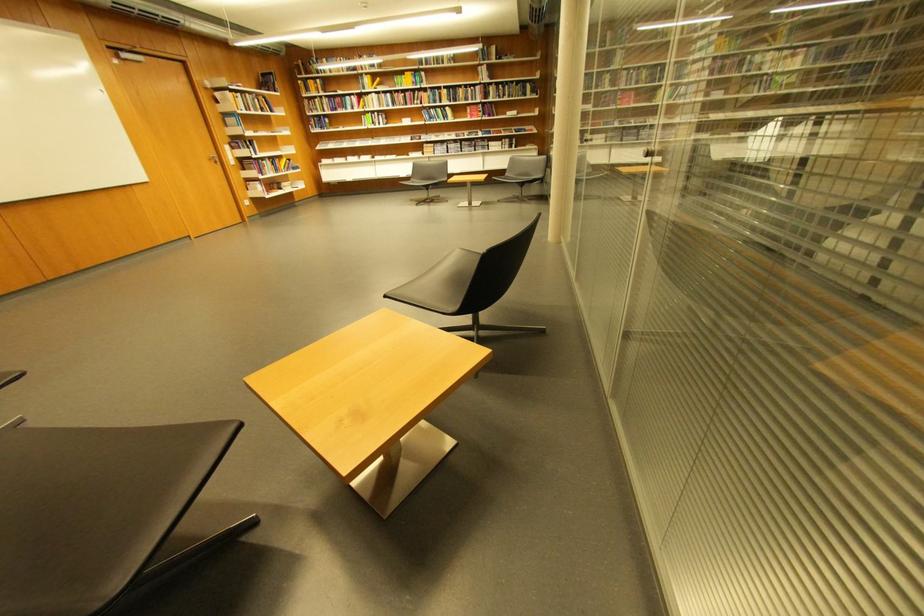
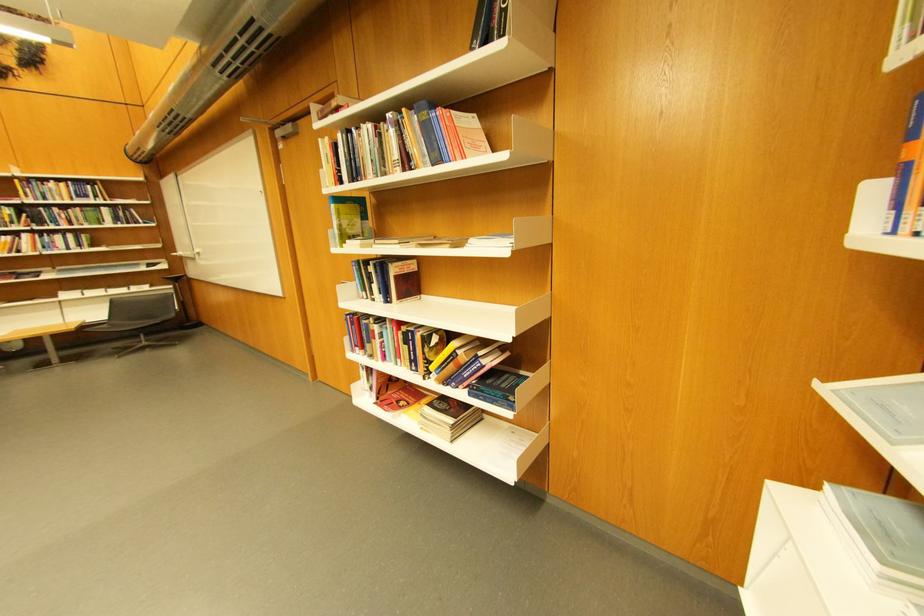
Where in the second image is the point corresponding to point 256,99 from the first image?

(370, 137)